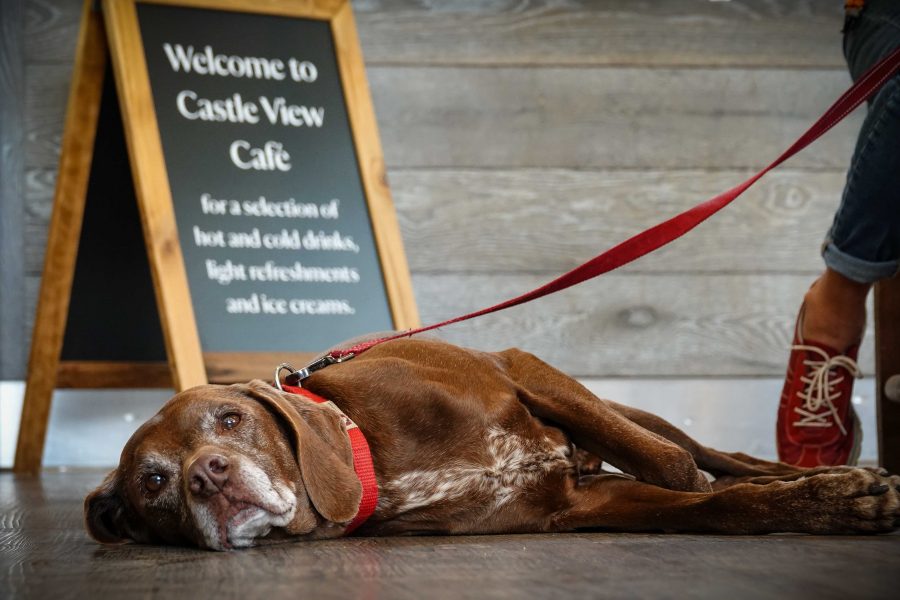
Find the location of a particular element. chest is located at coordinates (428, 493), (516, 472).